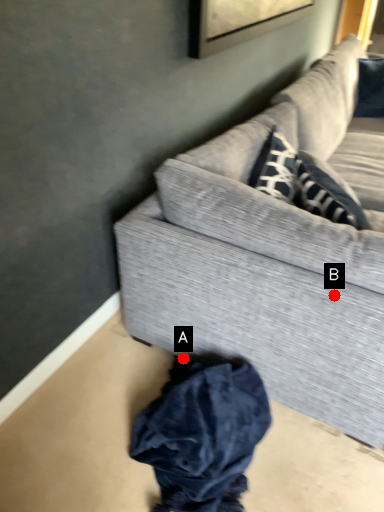
Question: Two points are circled on the image, labeled by A and B beside each circle. Which point is farther from the camera taking this photo?

Choices:
 (A) A is further
 (B) B is further

Answer: (A)